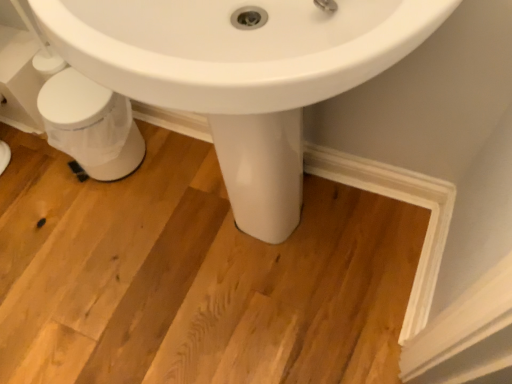
Question: Does white plastic trash can at lower left lie in front of white glossy sink at center?

Choices:
 (A) yes
 (B) no

Answer: (B)

Question: Is white plastic trash can at lower left bigger than white glossy sink at center?

Choices:
 (A) yes
 (B) no

Answer: (B)

Question: Can you see white plastic trash can at lower left touching white glossy sink at center?

Choices:
 (A) yes
 (B) no

Answer: (B)

Question: From a real-world perspective, does white plastic trash can at lower left stand above white glossy sink at center?

Choices:
 (A) no
 (B) yes

Answer: (A)

Question: From the image's perspective, is white plastic trash can at lower left above white glossy sink at center?

Choices:
 (A) no
 (B) yes

Answer: (B)

Question: Is white plastic trash can at lower left at the right side of white glossy sink at center?

Choices:
 (A) yes
 (B) no

Answer: (B)

Question: Is white glossy sink at center not near white plastic trash can at lower left?

Choices:
 (A) no
 (B) yes

Answer: (A)

Question: Is white glossy sink at center outside white plastic trash can at lower left?

Choices:
 (A) no
 (B) yes

Answer: (B)

Question: Is white glossy sink at center facing towards white plastic trash can at lower left?

Choices:
 (A) yes
 (B) no

Answer: (B)

Question: Does white glossy sink at center have a smaller size compared to white plastic trash can at lower left?

Choices:
 (A) yes
 (B) no

Answer: (B)

Question: Is white glossy sink at center turned away from white plastic trash can at lower left?

Choices:
 (A) no
 (B) yes

Answer: (A)

Question: Considering the relative positions of white glossy sink at center and white plastic trash can at lower left in the image provided, is white glossy sink at center in front of white plastic trash can at lower left?

Choices:
 (A) no
 (B) yes

Answer: (B)

Question: From the image's perspective, is white glossy sink at center positioned above or below white plastic trash can at lower left?

Choices:
 (A) above
 (B) below

Answer: (B)